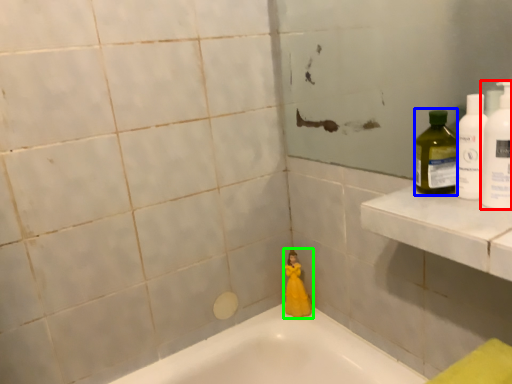
Question: Estimate the real-world distances between objects in this image. Which object is closer to cleaning product (highlighted by a red box), cleaning product (highlighted by a blue box) or toy (highlighted by a green box)?

Choices:
 (A) cleaning product
 (B) toy

Answer: (A)